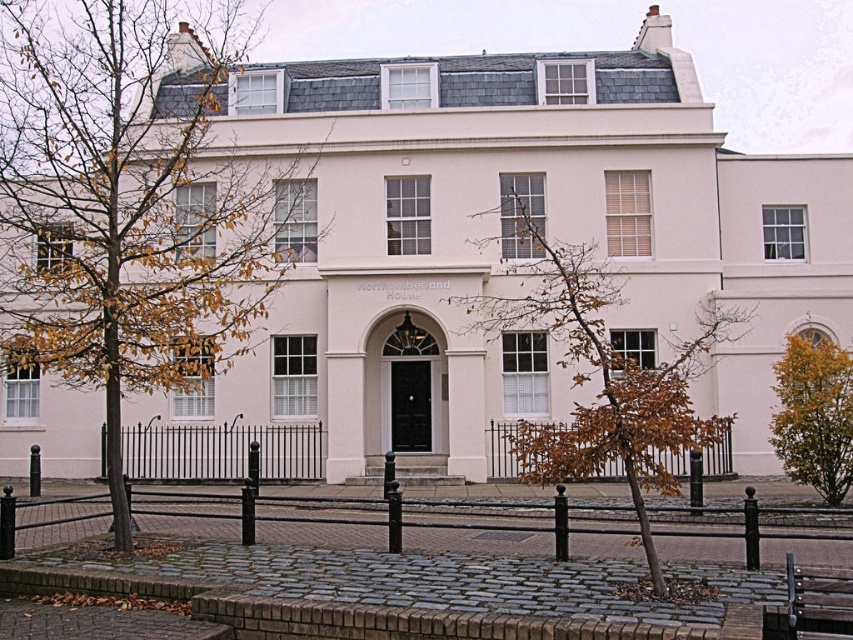
You are standing in front of Northumberland House and want to sit down. There is a brown leafy tree at left and a metallic silver bench at lower right. Which object is closer to the entrance of the building?

The metallic silver bench at lower right is closer to the entrance of Northumberland House because it is to the right of the brown leafy tree at left, which is further away.

You are standing in front of Northumberland House and want to walk from the black wrought iron fence at lower center to the brown leafy tree at center. Which direction should you move relative to the fence?

You should move to the right relative to the black wrought iron fence at lower center to reach the brown leafy tree at center, as the tree is positioned to the right of the fence.

You are planning to place a new flower pot between the brown leafy tree at left and the metallic silver bench at lower right. Based on their widths, which object should you consider for spacing adjustments?

The brown leafy tree at left might be wider than the metallic silver bench at lower right, so you should consider spacing adjustments around the brown leafy tree at left to accommodate its width.